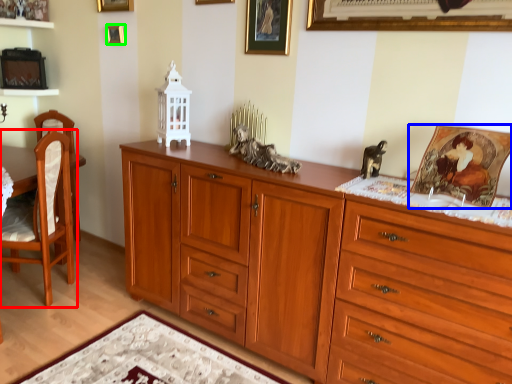
Question: Estimate the real-world distances between objects in this image. Which object is closer to chair (highlighted by a red box), picture frame (highlighted by a blue box) or picture frame (highlighted by a green box)?

Choices:
 (A) picture frame
 (B) picture frame

Answer: (B)